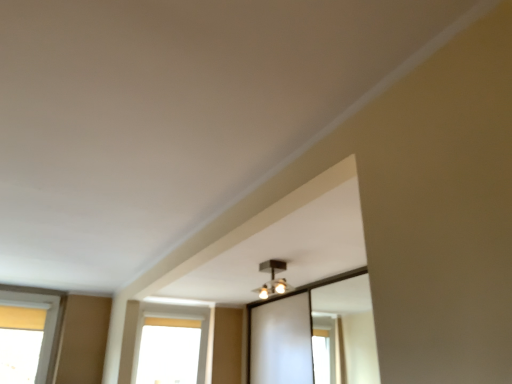
Question: In terms of width, does matte black light fixture at upper center look wider or thinner when compared to transparent glass window at lower center?

Choices:
 (A) wide
 (B) thin

Answer: (A)

Question: Is point (281, 278) closer or farther from the camera than point (146, 372)?

Choices:
 (A) closer
 (B) farther

Answer: (A)

Question: Is matte black light fixture at upper center inside or outside of transparent glass window at lower center?

Choices:
 (A) inside
 (B) outside

Answer: (B)

Question: Considering the positions of transparent glass window at lower center and matte black light fixture at upper center in the image, is transparent glass window at lower center taller or shorter than matte black light fixture at upper center?

Choices:
 (A) tall
 (B) short

Answer: (A)

Question: In the image, is transparent glass window at lower center on the left side or the right side of matte black light fixture at upper center?

Choices:
 (A) right
 (B) left

Answer: (B)

Question: Looking at their shapes, would you say transparent glass window at lower center is wider or thinner than matte black light fixture at upper center?

Choices:
 (A) wide
 (B) thin

Answer: (B)

Question: Based on their sizes in the image, would you say transparent glass window at lower center is bigger or smaller than matte black light fixture at upper center?

Choices:
 (A) small
 (B) big

Answer: (B)